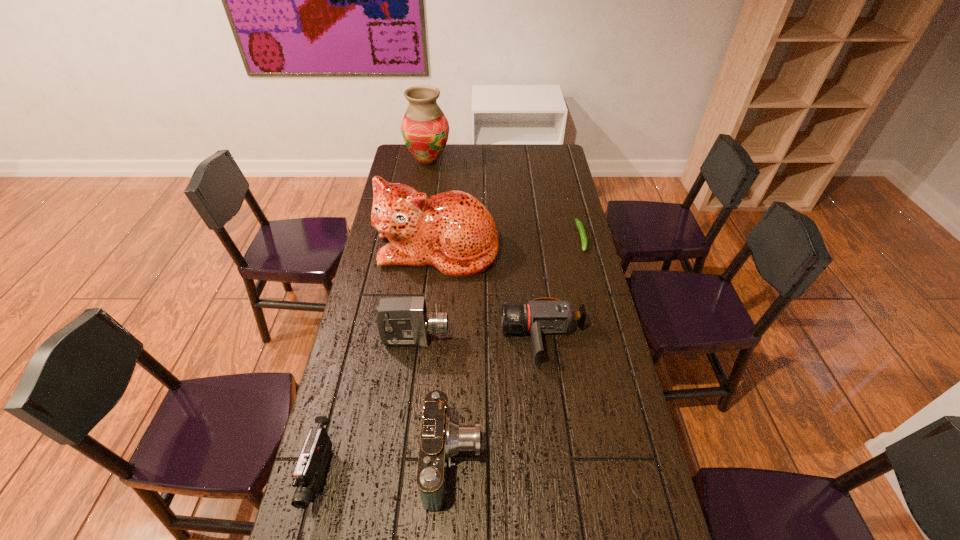
You are a GUI agent. You are given a task and a screenshot of the screen. Output one action in this format:
    pyautogui.click(x=<x>, y=<y>)
    Task: Click on the vase
    
    Given the screenshot: What is the action you would take?
    pyautogui.click(x=425, y=129)

Where is `cat`? The image size is (960, 540). cat is located at coordinates (453, 231).

This screenshot has width=960, height=540. I want to click on the tallest camcorder, so click(x=402, y=321).

The height and width of the screenshot is (540, 960). Find the location of `the third shortest object`. the third shortest object is located at coordinates (308, 476).

What are the coordinates of `the leftmost camcorder` in the screenshot? It's located at 308,476.

Locate an element on the screen. the sixth tallest object is located at coordinates (540, 316).

You are a GUI agent. You are given a task and a screenshot of the screen. Output one action in this format:
    pyautogui.click(x=<x>, y=<y>)
    Task: Click on the rightmost camcorder
    The width and height of the screenshot is (960, 540).
    Given the screenshot: What is the action you would take?
    pyautogui.click(x=540, y=316)

Find the location of `zucchini`. zucchini is located at coordinates click(579, 224).

Identify the location of the rightmost object. The width and height of the screenshot is (960, 540). (579, 224).

Find the location of `blank space located on the front of the farthest object`. blank space located on the front of the farthest object is located at coordinates (419, 222).